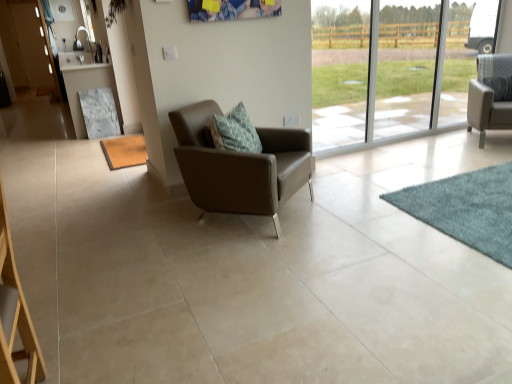
Identify the location of vacant area that lies in front of brown textured mat at lower left, which is the 2th mat in front-to-back order. The height and width of the screenshot is (384, 512). (77, 179).